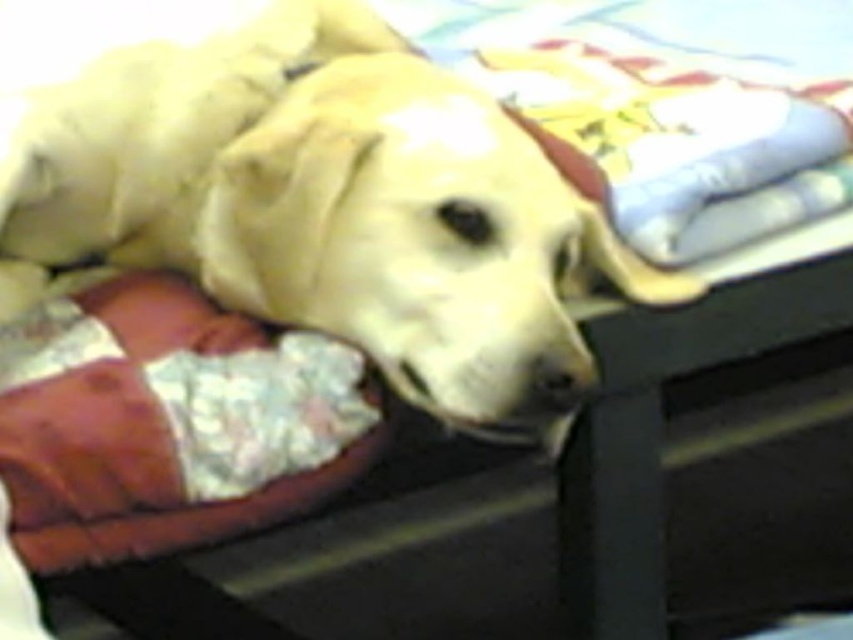
Question: Which object appears farthest from the camera in this image?

Choices:
 (A) velvet-like brown dog bed at lower left
 (B) yellow fur dog at center

Answer: (B)

Question: Which of the following is the farthest from the observer?

Choices:
 (A) (524, 218)
 (B) (207, 513)

Answer: (A)

Question: Which point is closer to the camera taking this photo?

Choices:
 (A) pos(148,296)
 (B) pos(311,307)

Answer: (B)

Question: From the image, what is the correct spatial relationship of yellow fur dog at center in relation to velvet-like brown dog bed at lower left?

Choices:
 (A) above
 (B) below

Answer: (A)

Question: Can you confirm if yellow fur dog at center is bigger than velvet-like brown dog bed at lower left?

Choices:
 (A) no
 (B) yes

Answer: (B)

Question: Is yellow fur dog at center smaller than velvet-like brown dog bed at lower left?

Choices:
 (A) no
 (B) yes

Answer: (A)